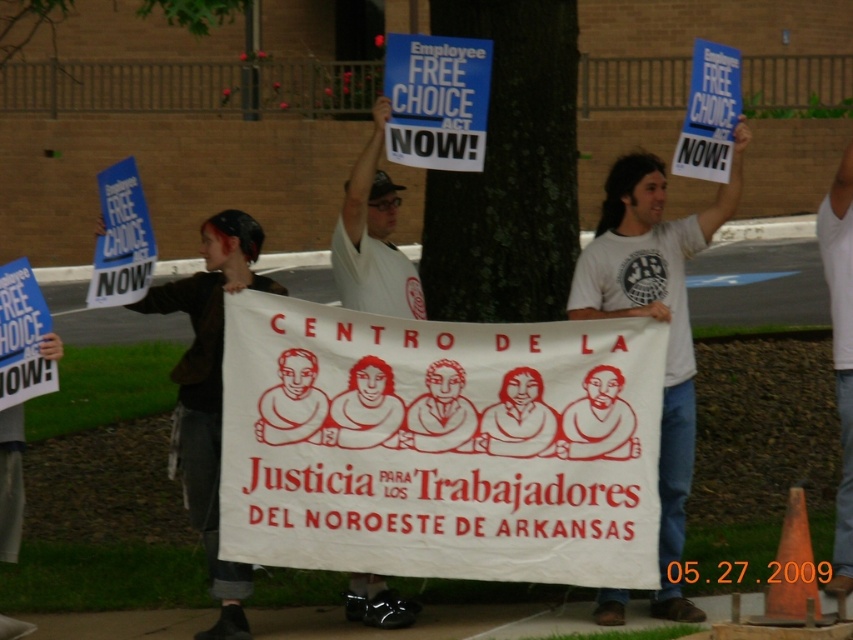
Is green rough bark tree at center smaller than white cotton shirt at center?

Indeed, green rough bark tree at center has a smaller size compared to white cotton shirt at center.

Which of these two, green rough bark tree at center or white cotton shirt at center, stands taller?

white cotton shirt at center is taller.

Which is behind, point (552, 234) or point (381, 301)?

Positioned behind is point (552, 234).

At what (x,y) coordinates should I click in order to perform the action: click on green rough bark tree at center. Please return your answer as a coordinate pair (x, y). The image size is (853, 640). Looking at the image, I should click on (509, 172).

Can you confirm if white paper banner at center is positioned below white cotton tank top at upper right?

Yes.

Is white paper banner at center above white cotton tank top at upper right?

No.

Between point (352, 323) and point (849, 456), which one is positioned in front?

Point (352, 323)

Locate an element on the screen. Image resolution: width=853 pixels, height=640 pixels. white paper banner at center is located at coordinates (440, 444).

Is white t-shirt at center wider than blue paper sign at upper center?

Yes.

Is white t-shirt at center to the right of blue paper sign at upper center from the viewer's perspective?

Correct, you'll find white t-shirt at center to the right of blue paper sign at upper center.

Is point (723, 193) farther from camera compared to point (393, 36)?

Yes, it is.

Where is `white t-shirt at center`? Image resolution: width=853 pixels, height=640 pixels. white t-shirt at center is located at coordinates (657, 320).